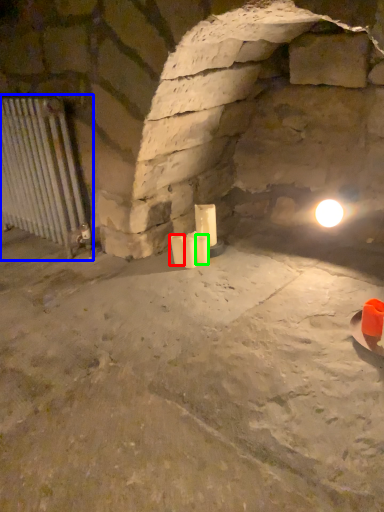
Question: Which is farther away from candle (highlighted by a red box)? cage (highlighted by a blue box) or candle (highlighted by a green box)?

Choices:
 (A) cage
 (B) candle

Answer: (A)